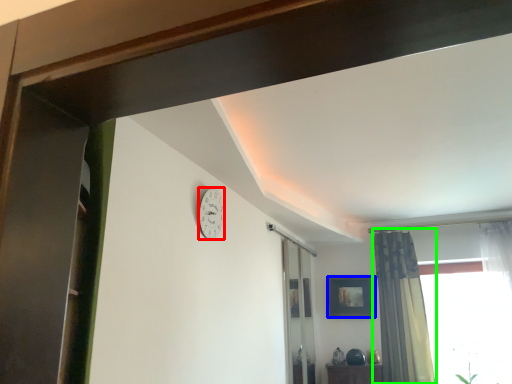
Question: Which is nearer to the clock (highlighted by a red box)? picture frame (highlighted by a blue box) or curtain (highlighted by a green box).

Choices:
 (A) picture frame
 (B) curtain

Answer: (B)